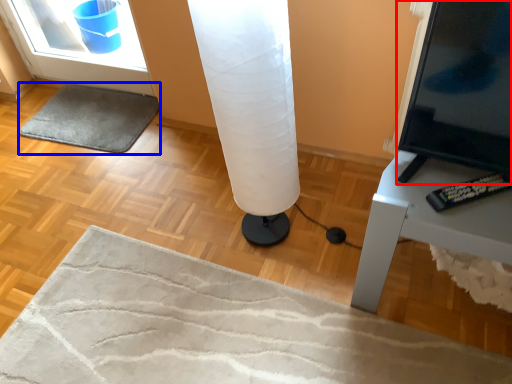
Question: Among these objects, which one is farthest to the camera, screen (highlighted by a red box) or yoga mat (highlighted by a blue box)?

Choices:
 (A) screen
 (B) yoga mat

Answer: (B)